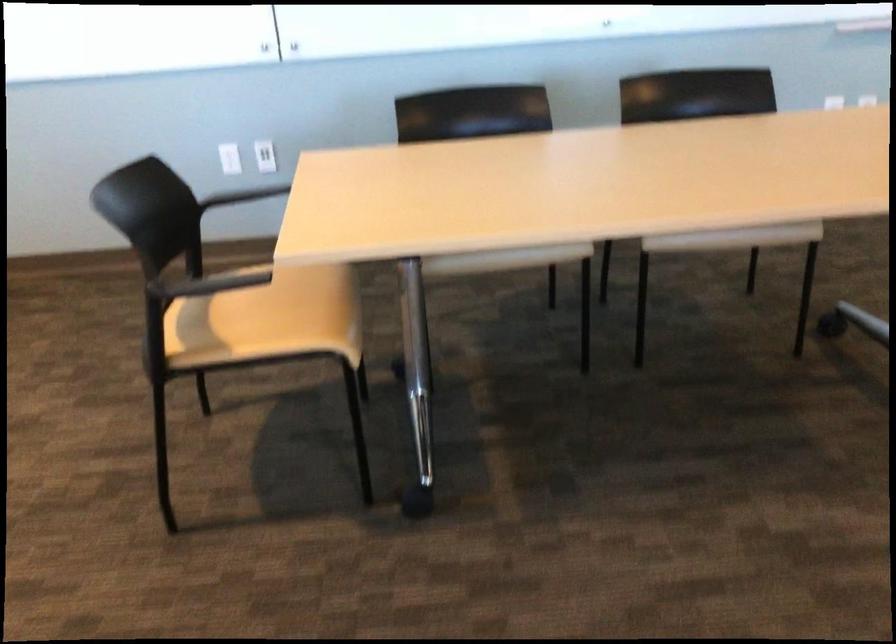
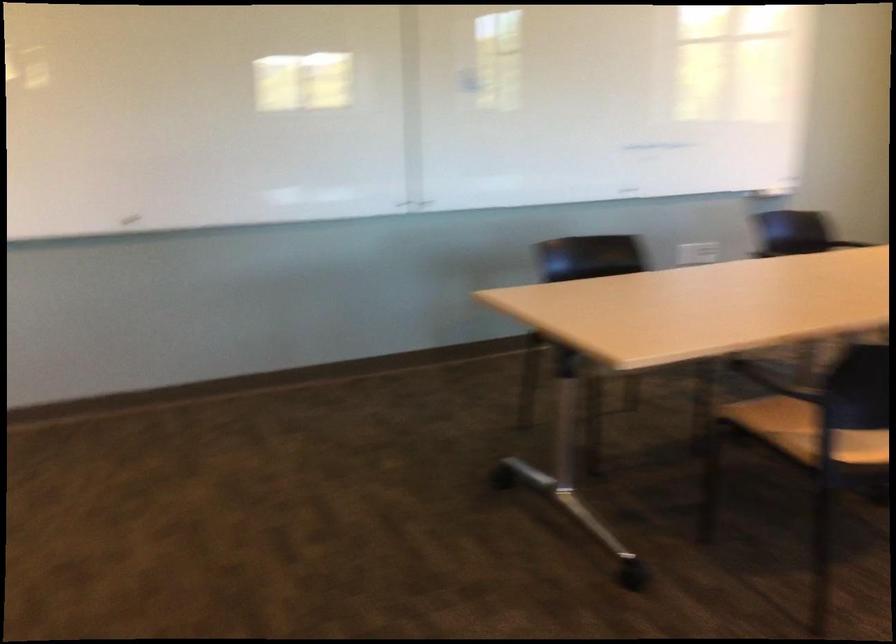
First-person continuous shooting, in which direction is the camera rotating?

The rotation direction of the camera is right-down.